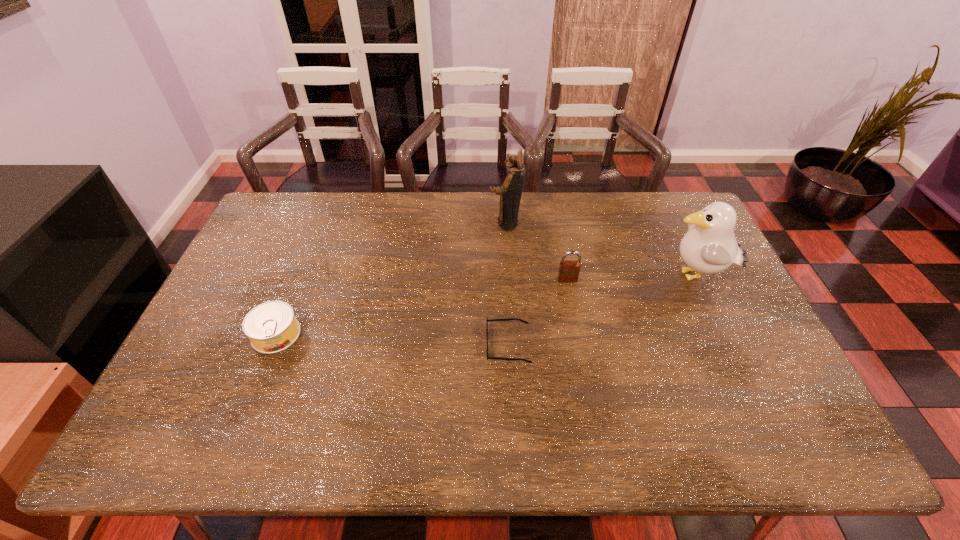
The image size is (960, 540). I want to click on figurine, so click(510, 192).

You are a GUI agent. You are given a task and a screenshot of the screen. Output one action in this format:
    pyautogui.click(x=<x>, y=<y>)
    Task: Click on the rightmost object
    The width and height of the screenshot is (960, 540).
    Given the screenshot: What is the action you would take?
    pyautogui.click(x=709, y=246)

Locate an element on the screen. This screenshot has width=960, height=540. the third tallest object is located at coordinates (569, 271).

Find the location of `padlock`. padlock is located at coordinates (569, 271).

This screenshot has width=960, height=540. In order to click on can in this screenshot , I will do `click(271, 327)`.

Identify the location of the fourth tallest object. This screenshot has height=540, width=960. point(271,327).

The height and width of the screenshot is (540, 960). I want to click on the shortest object, so click(498, 358).

The image size is (960, 540). Identify the location of vacant region located on the front-facing side of the figurine. (444, 223).

Identify the location of vacant space located 0.070m on the front-facing side of the figurine. The image size is (960, 540). (469, 223).

At what (x,y) coordinates should I click in order to perform the action: click on vacant area located on the front-facing side of the figurine. Please return your answer as a coordinate pair (x, y). Looking at the image, I should click on (386, 223).